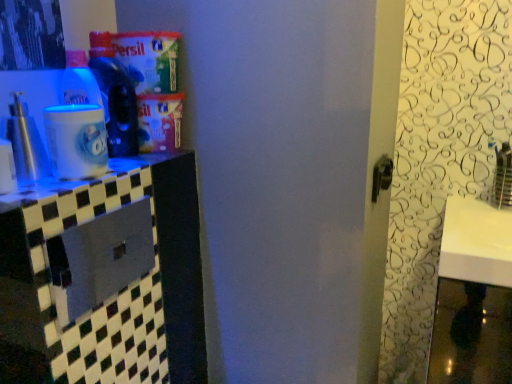
Question: From a real-world perspective, is translucent plastic bottle at upper left, which is counted as the 1th bottle, starting from the right, below white glossy counter top at left?

Choices:
 (A) no
 (B) yes

Answer: (A)

Question: Is white glossy counter top at left completely or partially inside translucent plastic bottle at upper left, the second bottle in the left-to-right sequence?

Choices:
 (A) yes
 (B) no

Answer: (B)

Question: Considering the relative sizes of translucent plastic bottle at upper left, the second bottle in the left-to-right sequence, and white glossy counter top at left in the image provided, is translucent plastic bottle at upper left, the second bottle in the left-to-right sequence, smaller than white glossy counter top at left?

Choices:
 (A) yes
 (B) no

Answer: (B)

Question: Does translucent plastic bottle at upper left, which is the 2th bottle in front-to-back order, have a greater height compared to white glossy counter top at left?

Choices:
 (A) yes
 (B) no

Answer: (A)

Question: From the image's perspective, is translucent plastic bottle at upper left, the 1th bottle viewed from the back, on top of white glossy counter top at left?

Choices:
 (A) yes
 (B) no

Answer: (A)

Question: Can we say translucent plastic bottle at upper left, which is counted as the 1th bottle, starting from the right, lies outside white glossy counter top at left?

Choices:
 (A) yes
 (B) no

Answer: (A)

Question: Would you consider white glossy counter top at left to be distant from metallic gray drawer at left?

Choices:
 (A) yes
 (B) no

Answer: (B)

Question: Is the position of white glossy counter top at left less distant than that of metallic gray drawer at left?

Choices:
 (A) no
 (B) yes

Answer: (B)

Question: Is metallic gray drawer at left surrounded by white glossy counter top at left?

Choices:
 (A) yes
 (B) no

Answer: (B)

Question: From a real-world perspective, is white glossy counter top at left physically above metallic gray drawer at left?

Choices:
 (A) yes
 (B) no

Answer: (A)

Question: Is white glossy counter top at left in contact with metallic gray drawer at left?

Choices:
 (A) yes
 (B) no

Answer: (B)

Question: Is white glossy counter top at left behind metallic gray drawer at left?

Choices:
 (A) yes
 (B) no

Answer: (B)

Question: Is metallic silver spray at left, the first bottle when ordered from front to back, in front of metallic gray drawer at left?

Choices:
 (A) yes
 (B) no

Answer: (B)